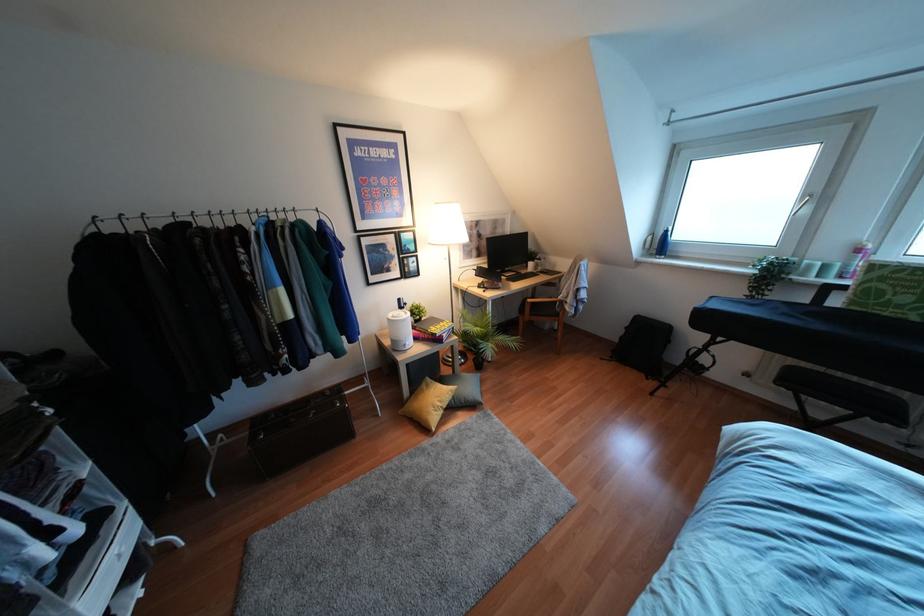
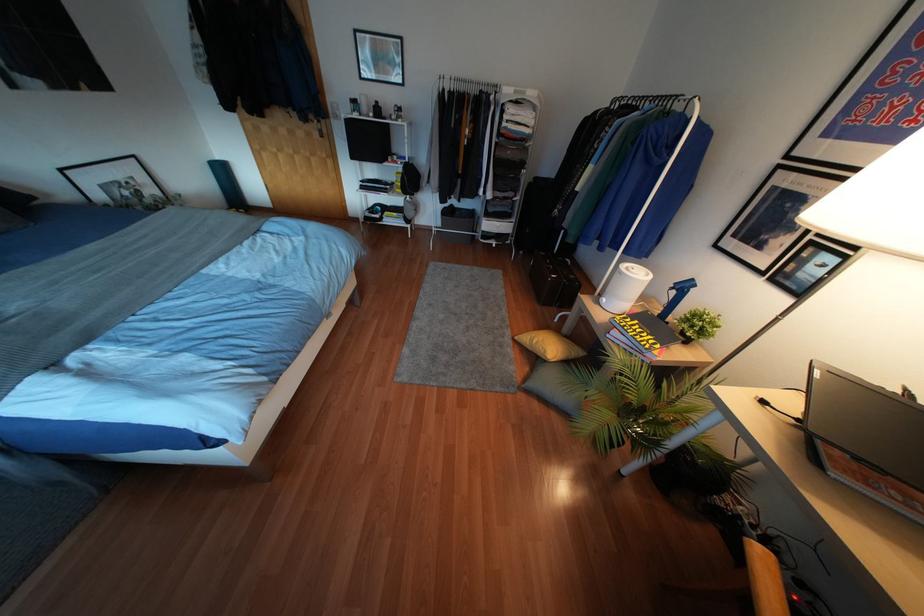
Find the pixel in the second image that matches the point at 398,299 in the first image.

(690, 280)